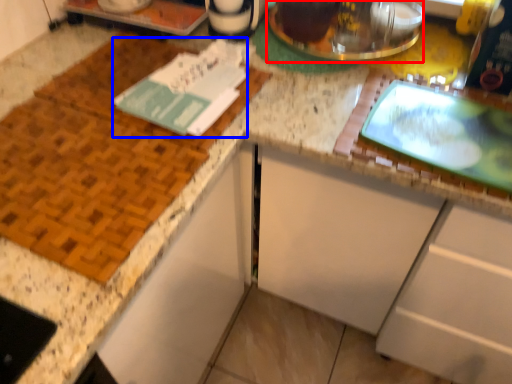
Question: Which object is further to the camera taking this photo, appliance (highlighted by a red box) or journal (highlighted by a blue box)?

Choices:
 (A) appliance
 (B) journal

Answer: (A)